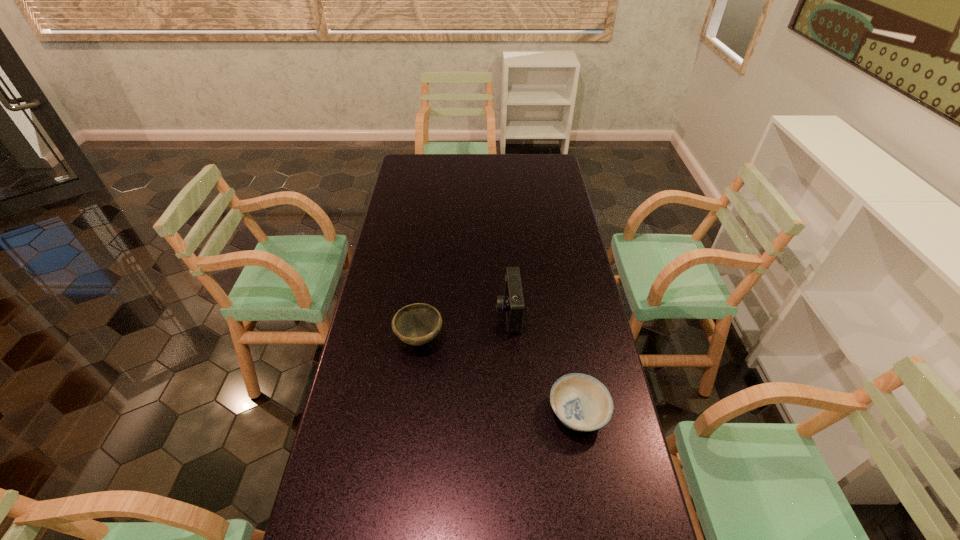
At what (x,y) coordinates should I click in order to perform the action: click on vacant space situated 0.340m on the left of the nearest object. Please return your answer as a coordinate pair (x, y). Looking at the image, I should click on (424, 413).

At what (x,y) coordinates should I click in order to perform the action: click on object that is at the left edge. Please return your answer as a coordinate pair (x, y). Looking at the image, I should click on (416, 324).

Identify the location of object that is at the right edge. (581, 402).

This screenshot has height=540, width=960. Find the location of `free space at the left edge of the desktop`. free space at the left edge of the desktop is located at coordinates pyautogui.click(x=416, y=276).

Where is `free spot at the right edge of the desktop`? This screenshot has height=540, width=960. free spot at the right edge of the desktop is located at coordinates pos(555,220).

The width and height of the screenshot is (960, 540). In the image, there is a desktop. Find the location of `free space at the far left corner`. free space at the far left corner is located at coordinates (432, 155).

I want to click on free space at the far right corner of the desktop, so click(544, 157).

Locate an element on the screen. vacant space in between the camera and the farther bowl is located at coordinates (464, 326).

Where is `vacant point located between the tallest object and the left bowl`? vacant point located between the tallest object and the left bowl is located at coordinates point(464,326).

Identify the location of vacant space that's between the nearer bowl and the second tallest object. [498, 376].